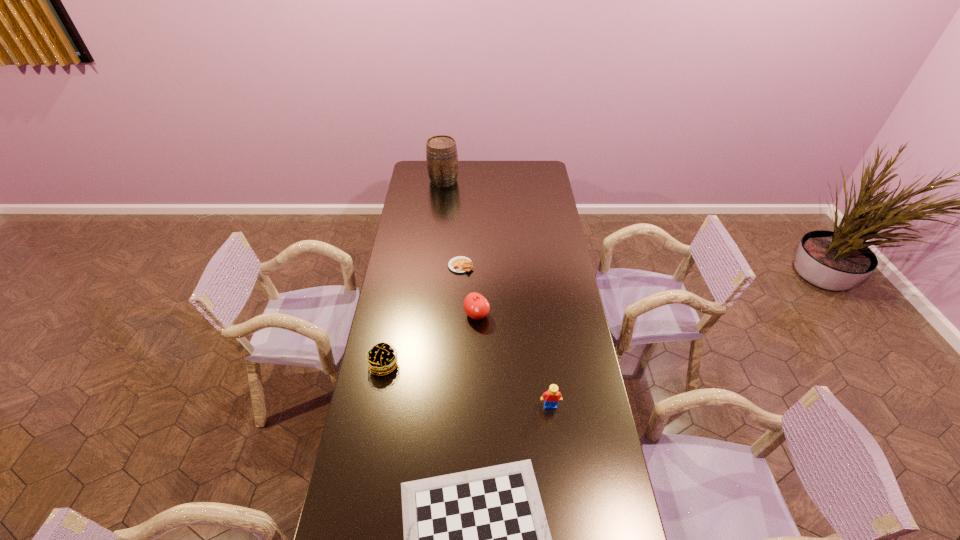
This screenshot has height=540, width=960. What are the coordinates of `cider` in the screenshot? It's located at (441, 151).

Find the location of a particular element. the farthest object is located at coordinates click(x=441, y=151).

At what (x,y) coordinates should I click in order to perform the action: click on Lego. Please return your answer as a coordinate pair (x, y). The image size is (960, 540). Looking at the image, I should click on (552, 396).

Locate an element on the screen. The image size is (960, 540). apple is located at coordinates (476, 306).

Where is `patty`? patty is located at coordinates (381, 358).

You are a GUI agent. You are given a task and a screenshot of the screen. Output one action in this format:
    pyautogui.click(x=<x>, y=<y>)
    Task: Click on the leftmost object
    This screenshot has height=540, width=960.
    Given the screenshot: What is the action you would take?
    (381, 358)

Identify the location of the second farthest object. (460, 264).

What are the coordinates of `vacant space located on the side of the tallest object near the bung hole` in the screenshot? It's located at (439, 221).

You are a GUI agent. You are given a task and a screenshot of the screen. Output one action in this format:
    pyautogui.click(x=<x>, y=<y>)
    Task: Click on the vacant space located on the face of the fifth farthest object
    Image resolution: width=960 pixels, height=540 pixels.
    Given the screenshot: What is the action you would take?
    pyautogui.click(x=564, y=521)

Locate an element on the screen. Image resolution: width=960 pixels, height=540 pixels. free region located 0.150m on the front of the third farthest object is located at coordinates (476, 355).